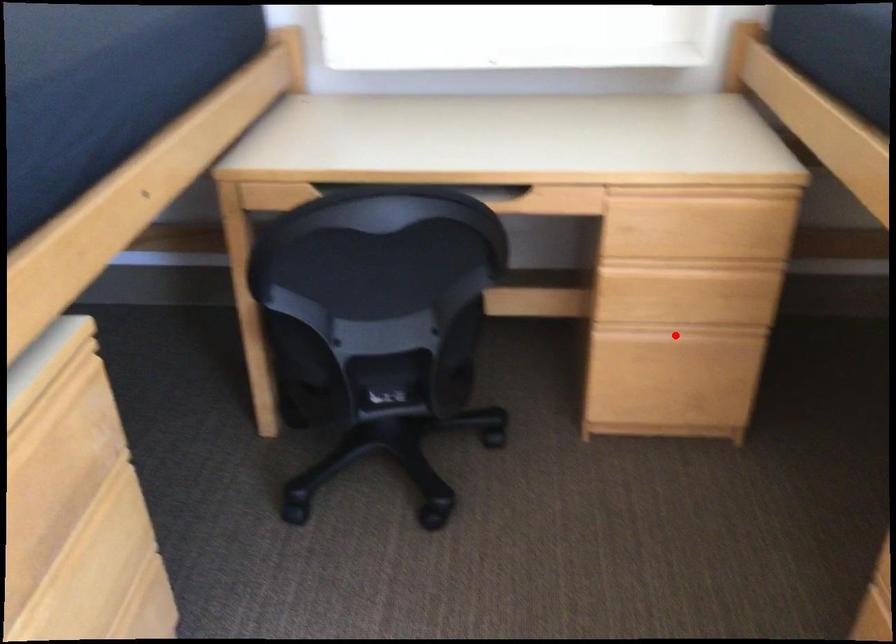
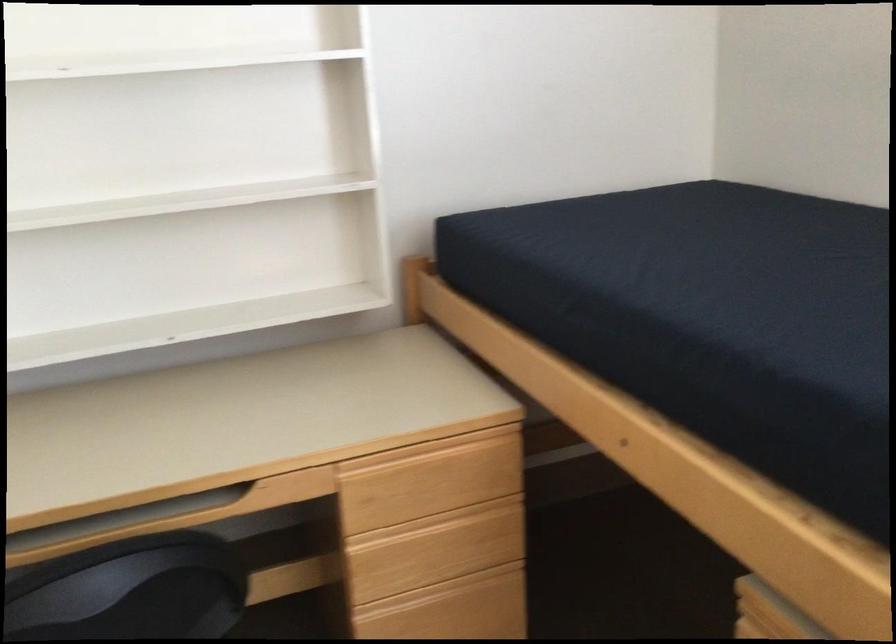
Locate, in the second image, the point that corresponds to the highlighted location in the first image.

(442, 592)